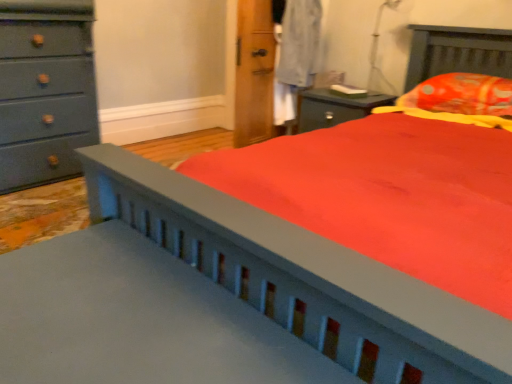
What is the approximate width of transparent plastic table lamp at upper right?

transparent plastic table lamp at upper right is 7.55 inches in width.

What do you see at coordinates (462, 95) in the screenshot?
I see `orange printed fabric pillow at upper right` at bounding box center [462, 95].

This screenshot has height=384, width=512. In order to click on matte gray dresser at left in this screenshot , I will do `click(45, 90)`.

Is matte gray dresser at left facing towards orange printed fabric pillow at upper right?

No, matte gray dresser at left does not turn towards orange printed fabric pillow at upper right.

Considering the positions of point (47, 136) and point (440, 89), is point (47, 136) closer or farther from the camera than point (440, 89)?

Point (47, 136) is positioned farther from the camera compared to point (440, 89).

Would you say matte gray dresser at left is a long distance from orange printed fabric pillow at upper right?

Yes, matte gray dresser at left is far from orange printed fabric pillow at upper right.

From the image's perspective, which is below, matte gray dresser at left or transparent plastic table lamp at upper right?

From the image's view, matte gray dresser at left is below.

Could you tell me if matte gray dresser at left is turned towards transparent plastic table lamp at upper right?

No, matte gray dresser at left is not oriented towards transparent plastic table lamp at upper right.

Considering the relative positions of matte gray dresser at left and transparent plastic table lamp at upper right in the image provided, is matte gray dresser at left to the right of transparent plastic table lamp at upper right from the viewer's perspective?

In fact, matte gray dresser at left is to the left of transparent plastic table lamp at upper right.

How much distance is there between matte gray dresser at left and transparent plastic table lamp at upper right?

matte gray dresser at left and transparent plastic table lamp at upper right are 2.07 meters apart.

From the picture: Is matte gray dresser at left at the back of orange printed fabric pillow at upper right?

No, orange printed fabric pillow at upper right is not facing the opposite direction of matte gray dresser at left.

Considering the relative positions of orange printed fabric pillow at upper right and matte gray dresser at left in the image provided, is orange printed fabric pillow at upper right to the right of matte gray dresser at left from the viewer's perspective?

Yes.

Where is `pillow located below the matte gray dresser at left (from the image's perspective)`? This screenshot has height=384, width=512. pillow located below the matte gray dresser at left (from the image's perspective) is located at coordinates (462, 95).

Does orange printed fabric pillow at upper right have a greater width compared to matte gray dresser at left?

Incorrect, the width of orange printed fabric pillow at upper right does not surpass that of matte gray dresser at left.

What's the angular difference between transparent plastic table lamp at upper right and matte gray dresser at left's facing directions?

There is a 80-degree angle between the facing directions of transparent plastic table lamp at upper right and matte gray dresser at left.

Considering the relative sizes of transparent plastic table lamp at upper right and matte gray dresser at left in the image provided, is transparent plastic table lamp at upper right taller than matte gray dresser at left?

No, transparent plastic table lamp at upper right is not taller than matte gray dresser at left.

Is transparent plastic table lamp at upper right outside of matte gray dresser at left?

That's correct, transparent plastic table lamp at upper right is outside of matte gray dresser at left.

Is transparent plastic table lamp at upper right aimed at matte gray dresser at left?

No, transparent plastic table lamp at upper right is not turned towards matte gray dresser at left.

Who is taller, transparent plastic table lamp at upper right or orange printed fabric pillow at upper right?

transparent plastic table lamp at upper right.

Is transparent plastic table lamp at upper right aimed at orange printed fabric pillow at upper right?

No, transparent plastic table lamp at upper right is not turned towards orange printed fabric pillow at upper right.

Considering the points (376, 67) and (470, 79), which point is behind, point (376, 67) or point (470, 79)?

The point (376, 67) is behind.

Does transparent plastic table lamp at upper right have a lesser width compared to orange printed fabric pillow at upper right?

Yes.

Is orange printed fabric pillow at upper right oriented towards transparent plastic table lamp at upper right?

No, orange printed fabric pillow at upper right is not aimed at transparent plastic table lamp at upper right.

Locate an element on the screen. pillow in front of the transparent plastic table lamp at upper right is located at coordinates (462, 95).

Can you confirm if orange printed fabric pillow at upper right is shorter than transparent plastic table lamp at upper right?

Yes, orange printed fabric pillow at upper right is shorter than transparent plastic table lamp at upper right.

Visually, is orange printed fabric pillow at upper right positioned to the left or to the right of transparent plastic table lamp at upper right?

In the image, orange printed fabric pillow at upper right appears on the right side of transparent plastic table lamp at upper right.

This screenshot has height=384, width=512. Find the location of `pillow that is on the right side of matte gray dresser at left`. pillow that is on the right side of matte gray dresser at left is located at coordinates (462, 95).

In the image, there is a matte gray dresser at left. Where is `table lamp above it (from the image's perspective)`? This screenshot has height=384, width=512. table lamp above it (from the image's perspective) is located at coordinates pos(377,47).

Consider the image. Considering their positions, is orange printed fabric pillow at upper right positioned further to matte gray dresser at left than transparent plastic table lamp at upper right?

Among the two, orange printed fabric pillow at upper right is located further to matte gray dresser at left.

Considering their positions, is matte gray dresser at left positioned further to transparent plastic table lamp at upper right than orange printed fabric pillow at upper right?

matte gray dresser at left.

Based on their spatial positions, is transparent plastic table lamp at upper right or matte gray dresser at left closer to orange printed fabric pillow at upper right?

The object closer to orange printed fabric pillow at upper right is transparent plastic table lamp at upper right.

From the image, which object appears to be farther from orange printed fabric pillow at upper right, matte gray dresser at left or transparent plastic table lamp at upper right?

matte gray dresser at left is further to orange printed fabric pillow at upper right.

From the picture: Based on their spatial positions, is transparent plastic table lamp at upper right or orange printed fabric pillow at upper right further from matte gray dresser at left?

orange printed fabric pillow at upper right is positioned further to the anchor matte gray dresser at left.

Based on their spatial positions, is orange printed fabric pillow at upper right or matte gray dresser at left closer to transparent plastic table lamp at upper right?

orange printed fabric pillow at upper right is positioned closer to the anchor transparent plastic table lamp at upper right.

Locate an element on the screen. This screenshot has width=512, height=384. table lamp between matte gray dresser at left and orange printed fabric pillow at upper right in the horizontal direction is located at coordinates (377, 47).